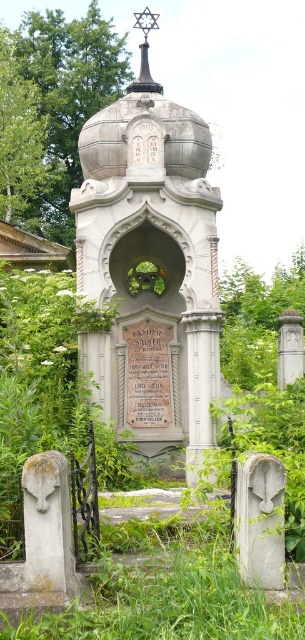
Question: Does polished stone monument at center have a larger size compared to green leafy tree at upper center?

Choices:
 (A) no
 (B) yes

Answer: (A)

Question: Which object appears closest to the camera in this image?

Choices:
 (A) polished stone monument at center
 (B) green leafy tree at upper left

Answer: (A)

Question: Does polished stone monument at center appear under green leafy tree at upper left?

Choices:
 (A) yes
 (B) no

Answer: (A)

Question: Is polished stone monument at center thinner than green leafy tree at upper center?

Choices:
 (A) no
 (B) yes

Answer: (B)

Question: Which point is closer to the camera?

Choices:
 (A) (21, 90)
 (B) (56, 56)
 (C) (88, 166)

Answer: (C)

Question: Which object is the farthest from the green leafy tree at upper left?

Choices:
 (A) polished stone monument at center
 (B) green leafy tree at upper center

Answer: (A)